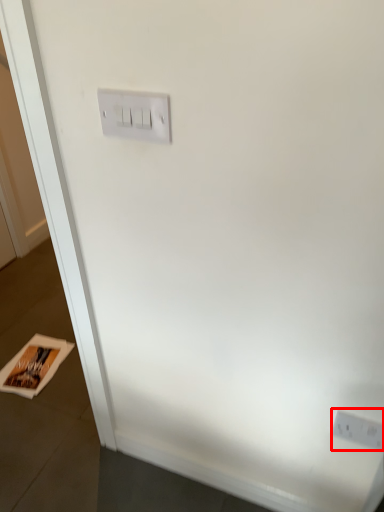
Question: From the image's perspective, considering the relative positions of power plugs and sockets (annotated by the red box) and magazine in the image provided, where is power plugs and sockets (annotated by the red box) located with respect to the staircase?

Choices:
 (A) above
 (B) below

Answer: (A)